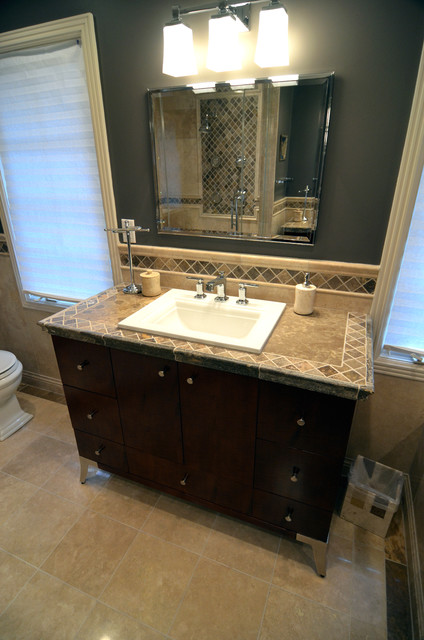
Locate an element on the screen. This screenshot has height=640, width=424. window shade is located at coordinates (54, 253).